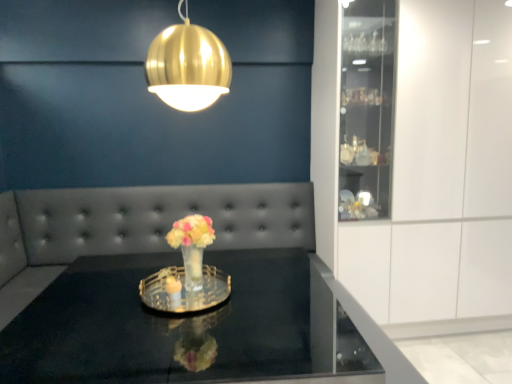
Question: Is the position of black glass table at center more distant than that of clear glass vase at center?

Choices:
 (A) no
 (B) yes

Answer: (A)

Question: Is black glass table at center with clear glass vase at center?

Choices:
 (A) no
 (B) yes

Answer: (A)

Question: From a real-world perspective, is black glass table at center over clear glass vase at center?

Choices:
 (A) no
 (B) yes

Answer: (A)

Question: Is black glass table at center positioned in front of clear glass vase at center?

Choices:
 (A) no
 (B) yes

Answer: (B)

Question: Is black glass table at center oriented towards clear glass vase at center?

Choices:
 (A) no
 (B) yes

Answer: (A)

Question: Is black glass table at center spatially inside clear glass tray at center, or outside of it?

Choices:
 (A) inside
 (B) outside

Answer: (B)

Question: Based on their sizes in the image, would you say black glass table at center is bigger or smaller than clear glass tray at center?

Choices:
 (A) big
 (B) small

Answer: (A)

Question: From a real-world perspective, is black glass table at center positioned above or below clear glass tray at center?

Choices:
 (A) above
 (B) below

Answer: (B)

Question: Considering their positions, is black glass table at center located in front of or behind clear glass tray at center?

Choices:
 (A) front
 (B) behind

Answer: (A)

Question: In terms of height, does clear glass vase at center look taller or shorter compared to gold metallic sphere at upper center?

Choices:
 (A) short
 (B) tall

Answer: (B)

Question: Based on their positions, is clear glass vase at center located to the left or right of gold metallic sphere at upper center?

Choices:
 (A) left
 (B) right

Answer: (A)

Question: Does point (152, 206) appear closer or farther from the camera than point (145, 59)?

Choices:
 (A) closer
 (B) farther

Answer: (B)

Question: From the image's perspective, relative to gold metallic sphere at upper center, is clear glass vase at center above or below?

Choices:
 (A) above
 (B) below

Answer: (B)

Question: In the image, is black glass table at center on the left side or the right side of translucent glass vase at center?

Choices:
 (A) right
 (B) left

Answer: (B)

Question: Considering the positions of black glass table at center and translucent glass vase at center in the image, is black glass table at center bigger or smaller than translucent glass vase at center?

Choices:
 (A) small
 (B) big

Answer: (B)